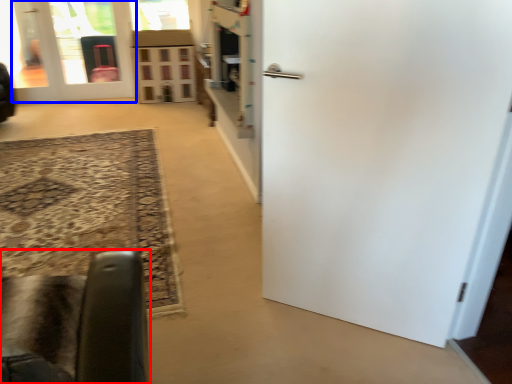
Question: Which point is closer to the camera, furniture (highlighted by a red box) or door (highlighted by a blue box)?

Choices:
 (A) furniture
 (B) door

Answer: (A)